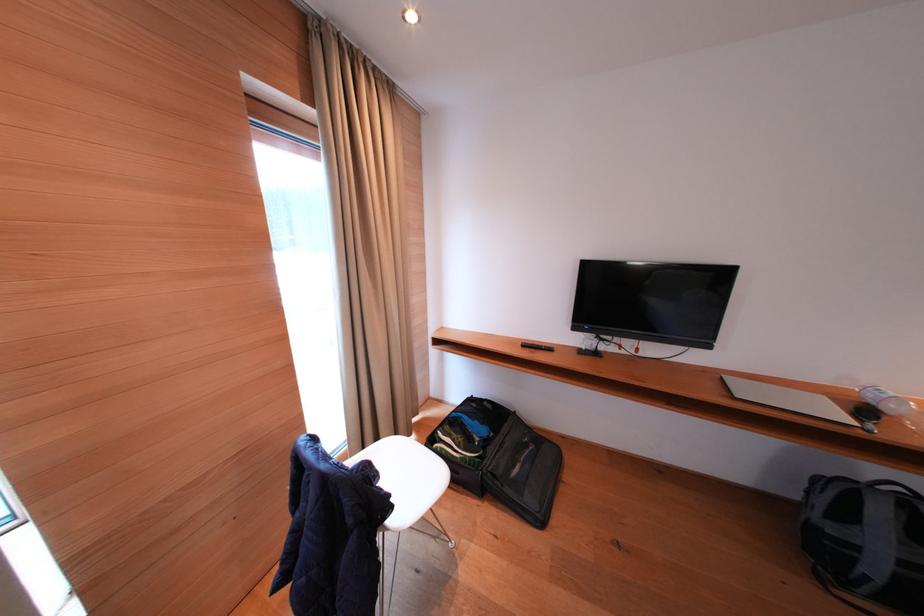
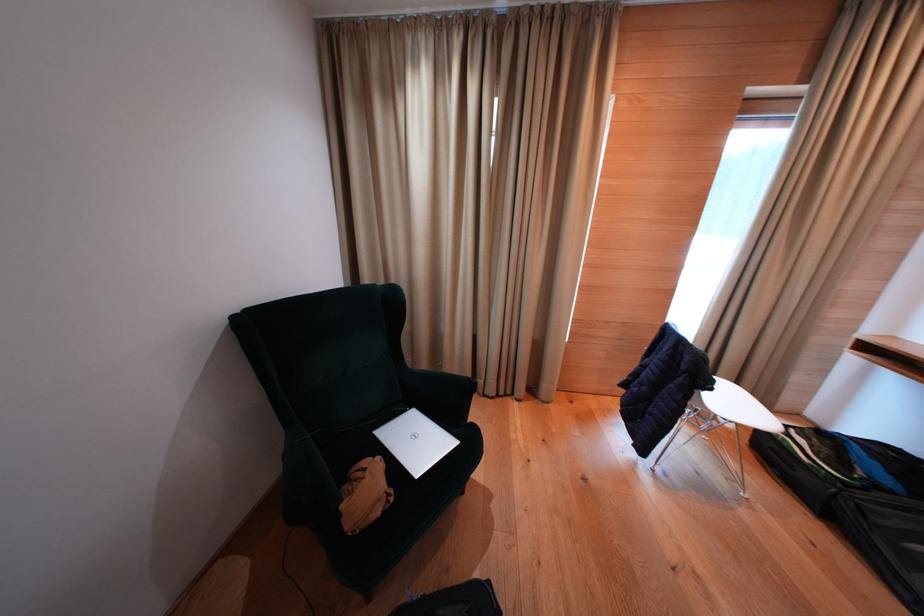
The images are taken continuously from a first-person perspective. In which direction is your viewpoint rotating?

The camera's rotation is toward left-down.